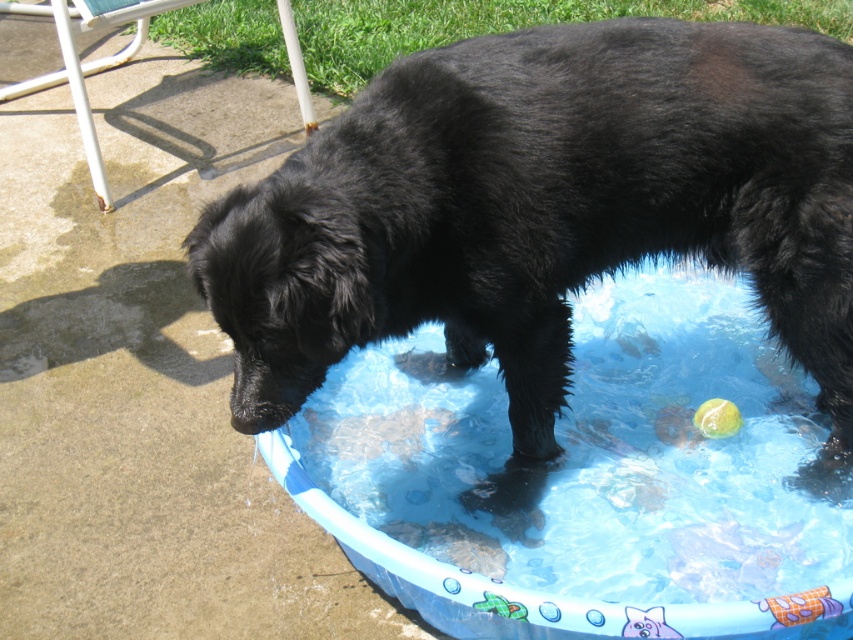
Question: Is black fluffy dog at center wider than blue plastic pool at center?

Choices:
 (A) no
 (B) yes

Answer: (B)

Question: Is black fluffy dog at center wider than blue plastic pool at center?

Choices:
 (A) no
 (B) yes

Answer: (B)

Question: Is black fluffy dog at center further to camera compared to blue plastic pool at center?

Choices:
 (A) yes
 (B) no

Answer: (A)

Question: Which object appears farthest from the camera in this image?

Choices:
 (A) black fluffy dog at center
 (B) blue plastic pool at center

Answer: (A)

Question: Which point is closer to the camera taking this photo?

Choices:
 (A) (672, 634)
 (B) (463, 131)

Answer: (A)